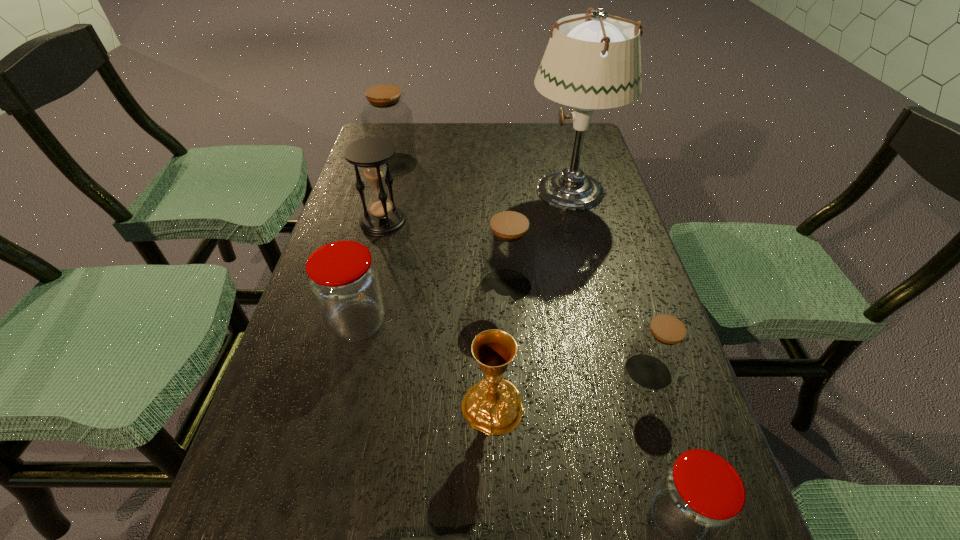
Find the location of a particular element. vacant space that satisfies the following two spatial constraints: 1. on the lampshade of the tallest object; 2. on the front side of the hourglass is located at coordinates coord(578,221).